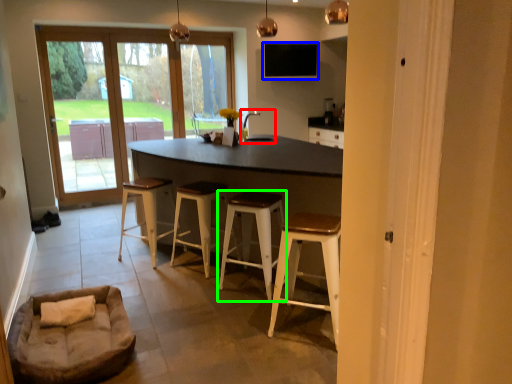
Question: Which object is the farthest from sink (highlighted by a red box)? Choose among these: window screen (highlighted by a blue box) or stool (highlighted by a green box).

Choices:
 (A) window screen
 (B) stool

Answer: (A)